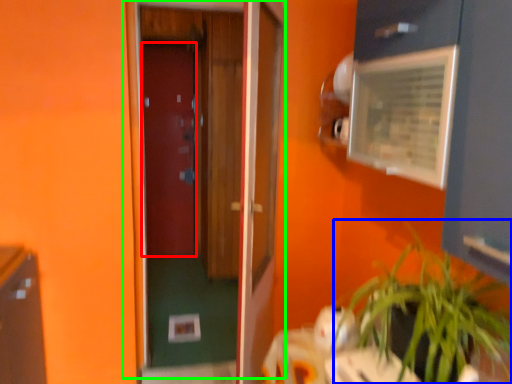
Question: Based on their relative distances, which object is farther from door (highlighted by a red box)? Choose from houseplant (highlighted by a blue box) and door (highlighted by a green box).

Choices:
 (A) houseplant
 (B) door

Answer: (A)